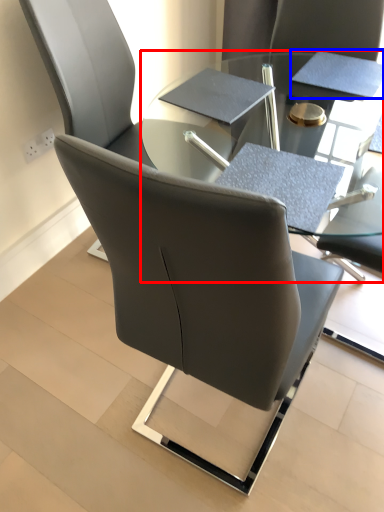
Question: Among these objects, which one is farthest to the camera, table (highlighted by a red box) or notepad (highlighted by a blue box)?

Choices:
 (A) table
 (B) notepad

Answer: (B)